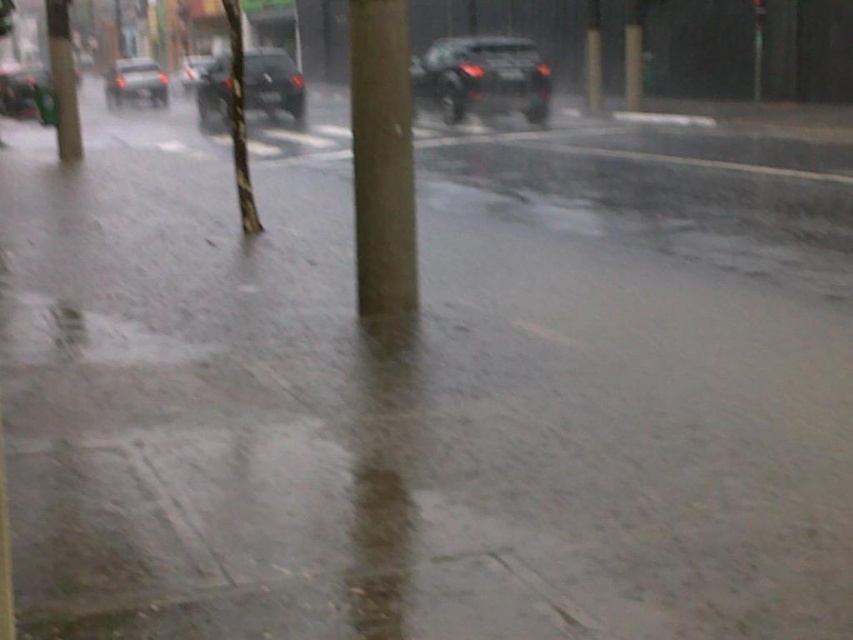
Question: Estimate the real-world distances between objects in this image. Which object is farther from the smooth brown pole at center?

Choices:
 (A) shiny black car at upper center
 (B) shiny black car at left

Answer: (A)

Question: Is brown wood pole at center bigger than smooth brown pole at center?

Choices:
 (A) no
 (B) yes

Answer: (A)

Question: Among these objects, which one is farthest from the camera?

Choices:
 (A) metallic silver car at left
 (B) smooth brown pole at center
 (C) shiny black car at left

Answer: (C)

Question: Which object is the closest to the smooth concrete pole at left?

Choices:
 (A) metallic silver car at left
 (B) shiny black car at upper center
 (C) shiny black car at center

Answer: (C)

Question: Is brown wood pole at center bigger than shiny black car at upper center?

Choices:
 (A) no
 (B) yes

Answer: (A)

Question: Is brown wood pole at center smaller than shiny black car at upper center?

Choices:
 (A) yes
 (B) no

Answer: (A)